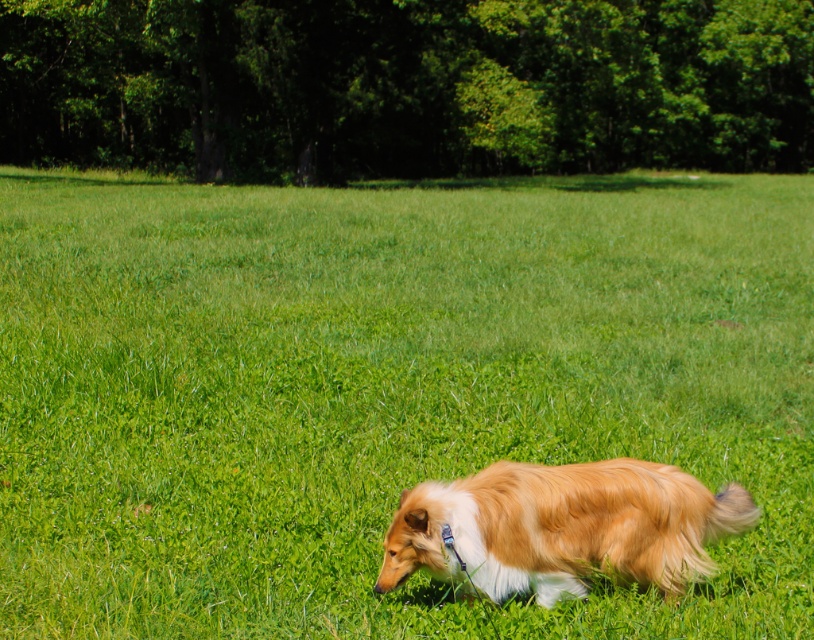
Question: Does green grassy field at center appear over golden fur dog at center?

Choices:
 (A) no
 (B) yes

Answer: (B)

Question: Which point appears closest to the camera in this image?

Choices:
 (A) (456, 486)
 (B) (772, 179)

Answer: (A)

Question: Does green grassy field at center come behind golden fur dog at center?

Choices:
 (A) no
 (B) yes

Answer: (B)

Question: Can you confirm if green grassy field at center is positioned below golden fur dog at center?

Choices:
 (A) yes
 (B) no

Answer: (B)